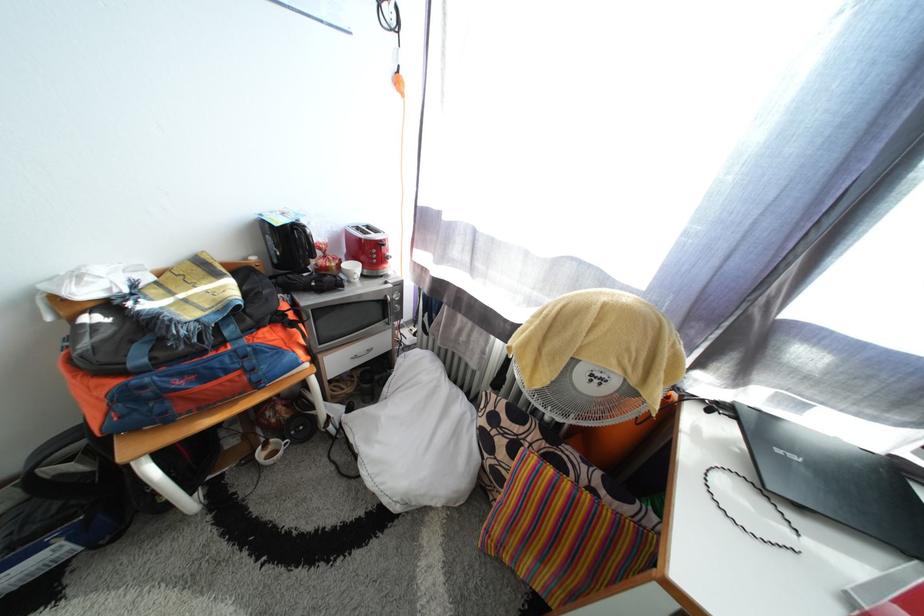
The location [271,451] corresponds to which object?

It corresponds to the white ceramic cup in the image.